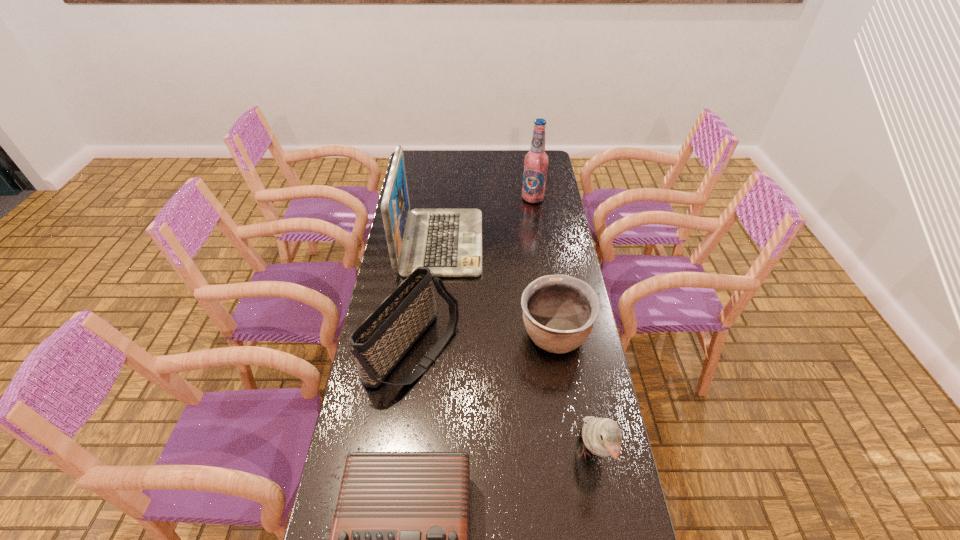
Where is `handbag located in the left edge section of the desktop`? This screenshot has height=540, width=960. handbag located in the left edge section of the desktop is located at coordinates (380, 342).

This screenshot has height=540, width=960. In order to click on alcohol at the right edge in this screenshot , I will do `click(536, 161)`.

Find the location of a particular element. This screenshot has height=540, width=960. bird positioned at the right edge is located at coordinates (602, 436).

The width and height of the screenshot is (960, 540). Find the location of `pottery present at the right edge`. pottery present at the right edge is located at coordinates (559, 311).

Where is `blank area at the far edge`? The image size is (960, 540). blank area at the far edge is located at coordinates (508, 173).

This screenshot has width=960, height=540. In the image, there is a desktop. In order to click on vacant space at the left edge in this screenshot , I will do point(428,183).

In the image, there is a desktop. Identify the location of free region at the right edge. (619, 484).

This screenshot has width=960, height=540. I want to click on free region at the far left corner of the desktop, so click(x=415, y=175).

Find the location of a particular element. The width and height of the screenshot is (960, 540). free space between the farthest object and the fifth nearest object is located at coordinates (x=487, y=220).

This screenshot has width=960, height=540. I want to click on free space that is in between the laptop computer and the bird, so click(x=516, y=349).